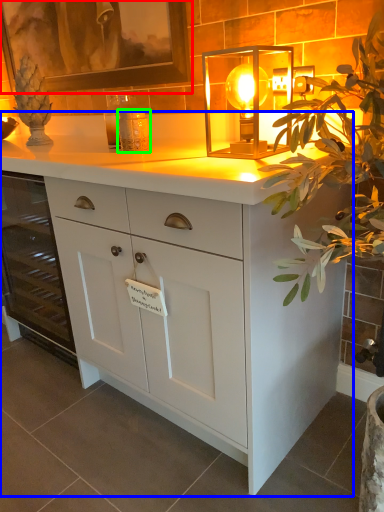
Question: Which object is the farthest from picture frame (highlighted by a red box)? Choose among these: chest of drawers (highlighted by a blue box) or candle holder (highlighted by a green box).

Choices:
 (A) chest of drawers
 (B) candle holder

Answer: (A)